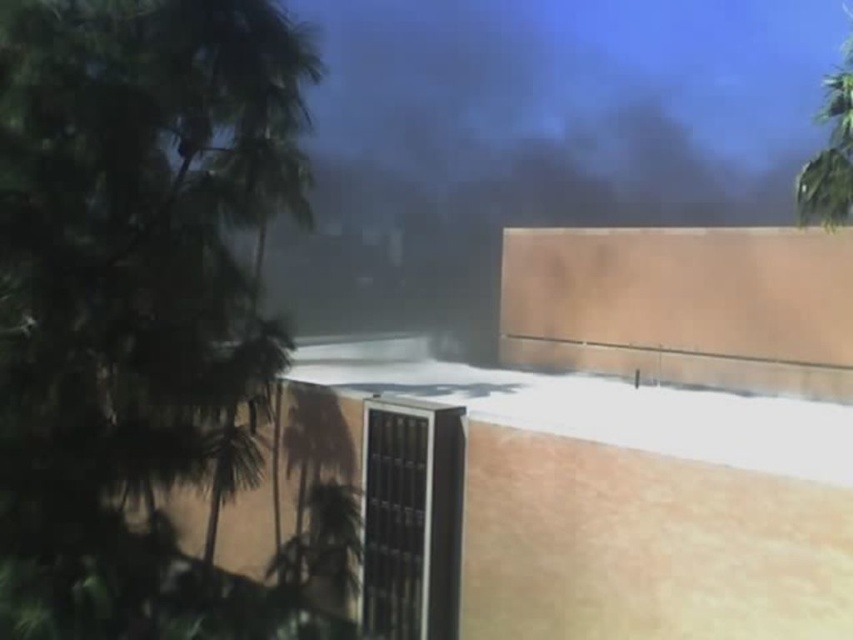
Which is more to the left, green leafy tree at left or green leafy tree at upper right?

Positioned to the left is green leafy tree at left.

Is point (3, 93) in front of point (833, 100)?

Yes, it is.

Image resolution: width=853 pixels, height=640 pixels. What are the coordinates of `green leafy tree at left` in the screenshot? It's located at (128, 273).